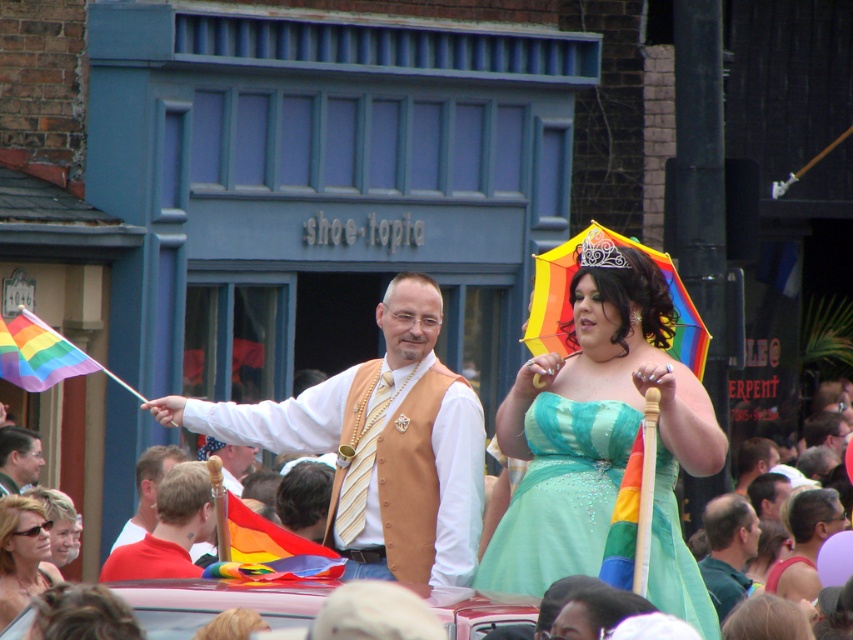
Consider the image. Measure the distance from green satin shirt at center to matte black shirt at center.

green satin shirt at center is 10.73 meters away from matte black shirt at center.

Who is more distant from viewer, (x=715, y=524) or (x=10, y=429)?

Point (x=715, y=524)

Who is more distant from viewer, (717, 595) or (6, 483)?

Positioned behind is point (6, 483).

Locate an element on the screen. The image size is (853, 640). green satin shirt at center is located at coordinates (728, 548).

Which is in front, point (165, 465) or point (36, 456)?

Point (165, 465)

Describe the element at coordinates (148, 490) in the screenshot. I see `white fabric shirt at center` at that location.

Between point (148, 493) and point (4, 493), which one is positioned behind?

The point (148, 493) is more distant.

Identify the location of white fabric shirt at center. (148, 490).

Who is positioned more to the left, shiny green dress at center or rainbow fabric flag at left?

From the viewer's perspective, rainbow fabric flag at left appears more on the left side.

Does shiny green dress at center lie in front of rainbow fabric flag at left?

Yes, shiny green dress at center is in front of rainbow fabric flag at left.

Where is `shiny green dress at center`? shiny green dress at center is located at coordinates (602, 436).